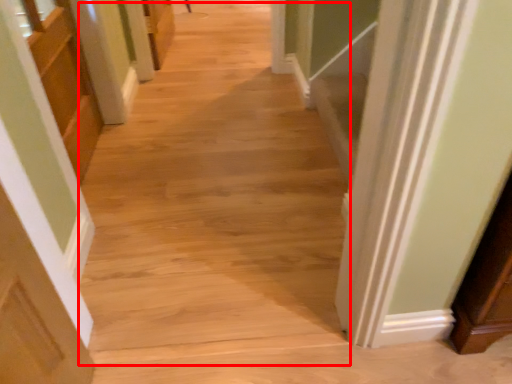
Question: From the image, what is the correct spatial relationship of aisle (annotated by the red box) in relation to cabinetry?

Choices:
 (A) left
 (B) right

Answer: (B)